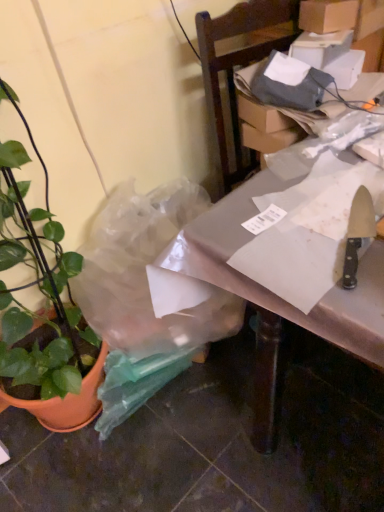
Question: Is point (79, 340) positioned closer to the camera than point (284, 284)?

Choices:
 (A) farther
 (B) closer

Answer: (A)

Question: Which is correct: green matte plant pot at left is inside white paper at right, or outside of it?

Choices:
 (A) outside
 (B) inside

Answer: (A)

Question: Which object is the closest to the cardboard box at upper right?

Choices:
 (A) metallic silver table at center
 (B) green matte plant pot at left
 (C) white paper at right
 (D) polished metal knife at right

Answer: (C)

Question: Considering the real-world distances, which object is closest to the metallic silver table at center?

Choices:
 (A) white paper at right
 (B) cardboard box at upper right
 (C) green matte plant pot at left
 (D) polished metal knife at right

Answer: (A)